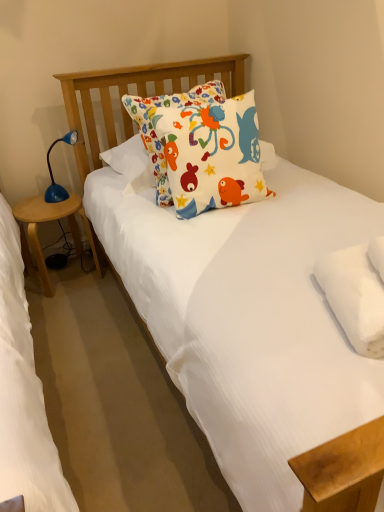
Where is `vacant space that is to the left of blue plastic table lamp at left`? The image size is (384, 512). vacant space that is to the left of blue plastic table lamp at left is located at coordinates click(x=30, y=204).